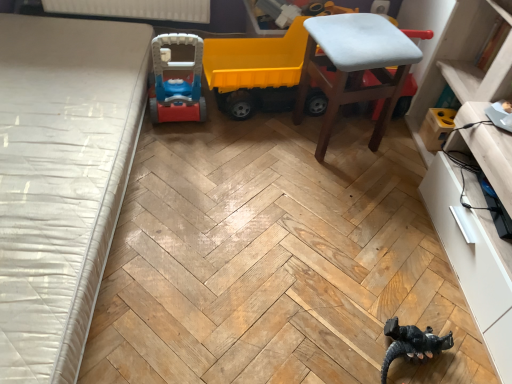
You are a GUI agent. You are given a task and a screenshot of the screen. Output one action in this format:
    pyautogui.click(x=<x>, y=<y>)
    Task: Click on the vacant space that's between white glossy dresser at lower right and yellow plastic toy truck at center
    The height and width of the screenshot is (384, 512).
    Given the screenshot: What is the action you would take?
    pyautogui.click(x=355, y=201)